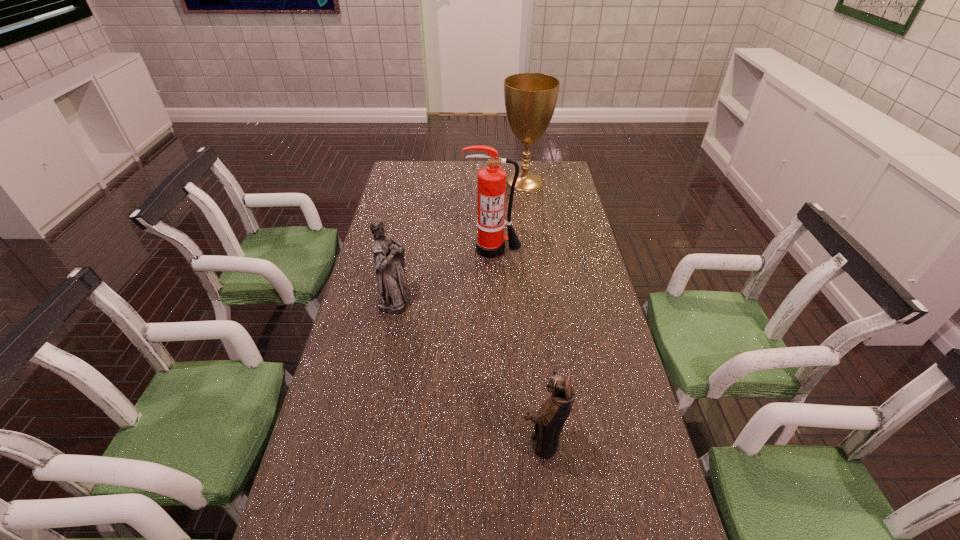
Locate an element on the screen. This screenshot has height=540, width=960. vacant area that lies between the third farthest object and the fire extinguisher is located at coordinates (444, 273).

Where is `free space that is in between the nearer figurine and the trophy cup`? The height and width of the screenshot is (540, 960). free space that is in between the nearer figurine and the trophy cup is located at coordinates (533, 312).

Locate an element on the screen. The height and width of the screenshot is (540, 960). free space between the trophy cup and the nearer figurine is located at coordinates (533, 312).

Identify the location of vacant point located between the nearest object and the farthest object. This screenshot has width=960, height=540. (533, 312).

This screenshot has height=540, width=960. I want to click on empty location between the right figurine and the trophy cup, so click(533, 312).

Identify the location of free space between the third nearest object and the nearer figurine. Image resolution: width=960 pixels, height=540 pixels. (517, 345).

I want to click on blank region between the trophy cup and the farther figurine, so click(460, 239).

This screenshot has width=960, height=540. I want to click on free spot between the leftmost object and the farthest object, so click(x=460, y=239).

Identify which object is the third closest to the nearest object. Please provide its 2D coordinates. Your answer should be formatted as a tuple, i.e. [(x, y)], where the tuple contains the x and y coordinates of a point satisfying the conditions above.

[(530, 98)]

Locate an element on the screen. the closest object relative to the trophy cup is located at coordinates (491, 180).